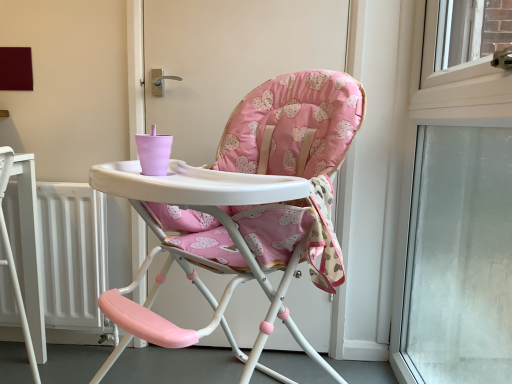
Question: From the image's perspective, is white matte radiator at lower left above transparent glass window at right?

Choices:
 (A) no
 (B) yes

Answer: (A)

Question: Is white matte radiator at lower left positioned with its back to transparent glass window at right?

Choices:
 (A) yes
 (B) no

Answer: (B)

Question: Is white matte radiator at lower left to the left of transparent glass window at right from the viewer's perspective?

Choices:
 (A) yes
 (B) no

Answer: (A)

Question: Is white matte radiator at lower left thinner than transparent glass window at right?

Choices:
 (A) no
 (B) yes

Answer: (B)

Question: Considering the relative positions of white matte radiator at lower left and transparent glass window at right in the image provided, is white matte radiator at lower left to the right of transparent glass window at right from the viewer's perspective?

Choices:
 (A) yes
 (B) no

Answer: (B)

Question: Choose the correct answer: Is pink fabric highchair at center inside transparent glass window at right or outside it?

Choices:
 (A) inside
 (B) outside

Answer: (B)

Question: Is point (346, 127) closer or farther from the camera than point (510, 288)?

Choices:
 (A) farther
 (B) closer

Answer: (B)

Question: Relative to transparent glass window at right, is pink fabric highchair at center in front or behind?

Choices:
 (A) behind
 (B) front

Answer: (A)

Question: From the image's perspective, is pink fabric highchair at center positioned above or below transparent glass window at right?

Choices:
 (A) above
 (B) below

Answer: (A)

Question: Is pink fabric highchair at center to the left or to the right of white matte radiator at lower left in the image?

Choices:
 (A) left
 (B) right

Answer: (B)

Question: Considering the positions of pink fabric highchair at center and white matte radiator at lower left in the image, is pink fabric highchair at center taller or shorter than white matte radiator at lower left?

Choices:
 (A) tall
 (B) short

Answer: (A)

Question: Would you say pink fabric highchair at center is inside or outside white matte radiator at lower left?

Choices:
 (A) outside
 (B) inside

Answer: (A)

Question: From the image's perspective, is pink fabric highchair at center located above or below white matte radiator at lower left?

Choices:
 (A) above
 (B) below

Answer: (A)

Question: Based on their sizes in the image, would you say transparent glass window at right is bigger or smaller than white matte radiator at lower left?

Choices:
 (A) small
 (B) big

Answer: (B)

Question: From a real-world perspective, relative to white matte radiator at lower left, is transparent glass window at right vertically above or below?

Choices:
 (A) below
 (B) above

Answer: (B)